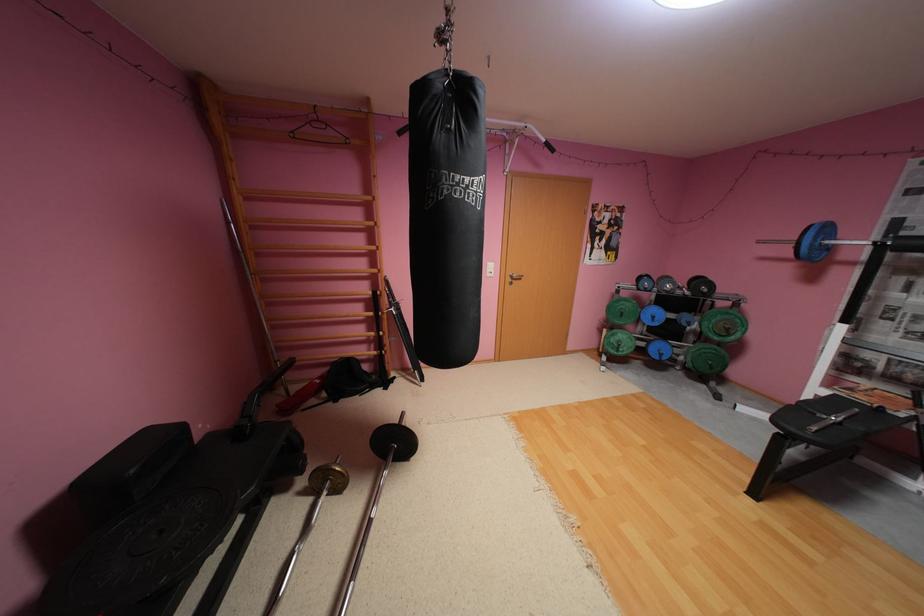
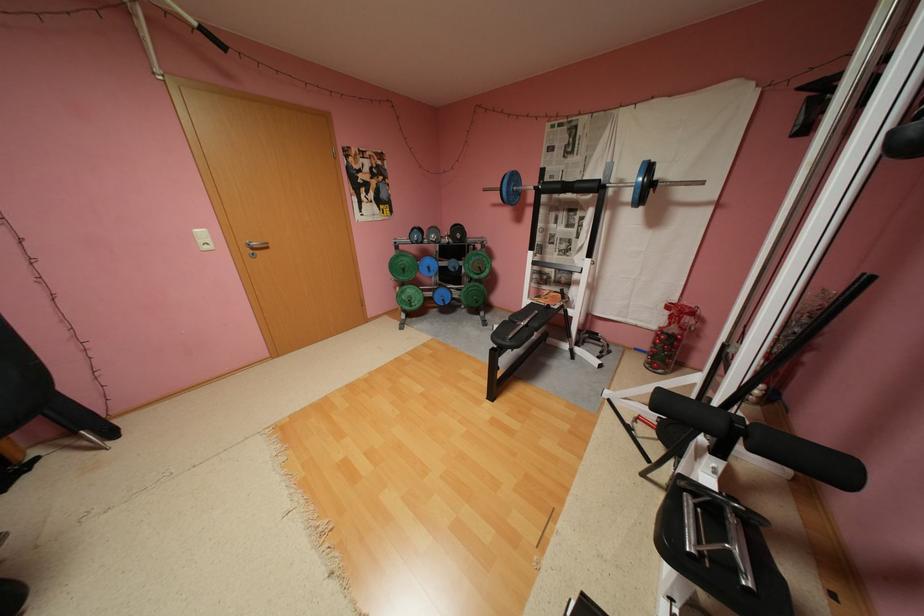
Where in the second image is the point corresponding to (x=665, y=318) from the first image?

(441, 269)